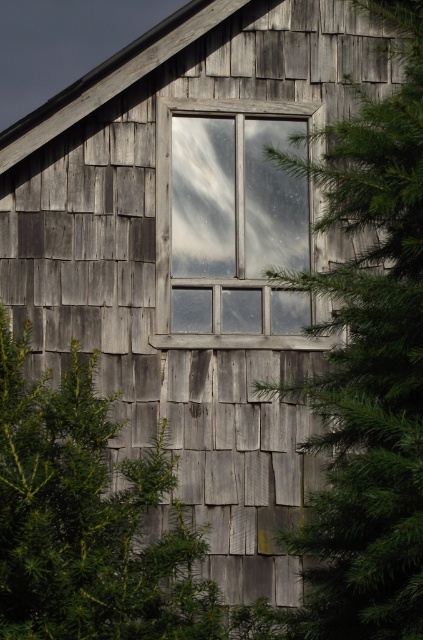
Question: Among these objects, which one is farthest from the camera?

Choices:
 (A) green textured pine tree at center
 (B) transparent glass window at center

Answer: (B)

Question: Which point is closer to the camera taking this photo?

Choices:
 (A) [313, 614]
 (B) [192, 308]

Answer: (A)

Question: Which point is farther to the camera?

Choices:
 (A) transparent glass window at center
 (B) green textured pine tree at center

Answer: (A)

Question: Does green textured pine tree at center appear under transparent glass window at center?

Choices:
 (A) no
 (B) yes

Answer: (B)

Question: Is green textured pine tree at center to the right of transparent glass window at center from the viewer's perspective?

Choices:
 (A) yes
 (B) no

Answer: (A)

Question: Is green textured pine tree at center to the right of transparent glass window at center from the viewer's perspective?

Choices:
 (A) no
 (B) yes

Answer: (B)